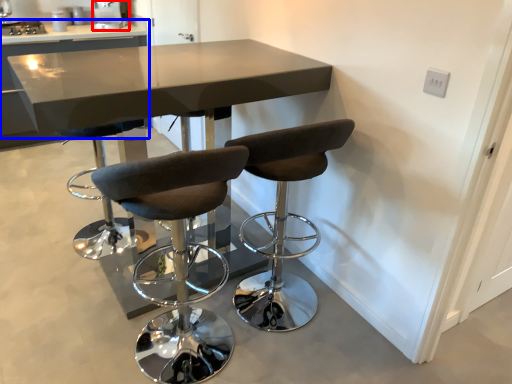
Question: Among these objects, which one is nearest to the camera, appliance (highlighted by a red box) or table (highlighted by a blue box)?

Choices:
 (A) appliance
 (B) table

Answer: (B)